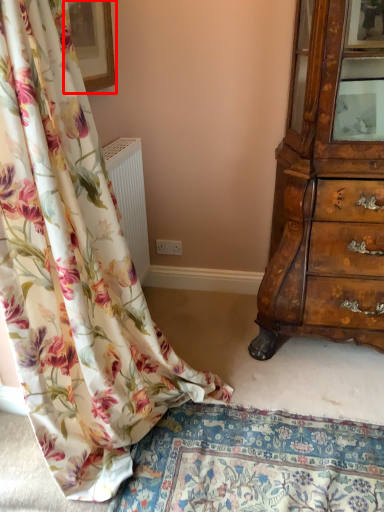
Question: Observing the image, what is the correct spatial positioning of picture frame (annotated by the red box) in reference to curtain?

Choices:
 (A) left
 (B) right

Answer: (A)